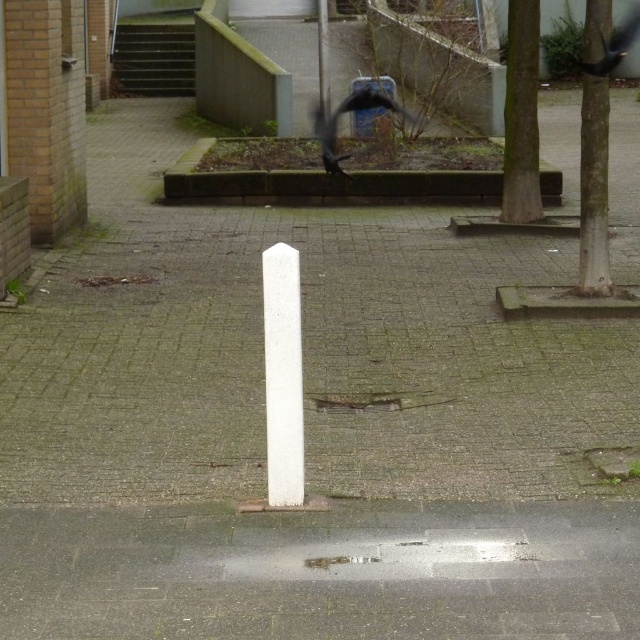
Does gray concrete pavement at center have a larger size compared to white stone post at center?

Correct, gray concrete pavement at center is larger in size than white stone post at center.

The image size is (640, 640). What do you see at coordinates (323, 572) in the screenshot? I see `gray concrete pavement at center` at bounding box center [323, 572].

Who is more distant from viewer, (230, 596) or (300, 390)?

The point (300, 390) is more distant.

At what (x,y) coordinates should I click in order to perform the action: click on gray concrete pavement at center. Please return your answer as a coordinate pair (x, y). The width and height of the screenshot is (640, 640). Looking at the image, I should click on (323, 572).